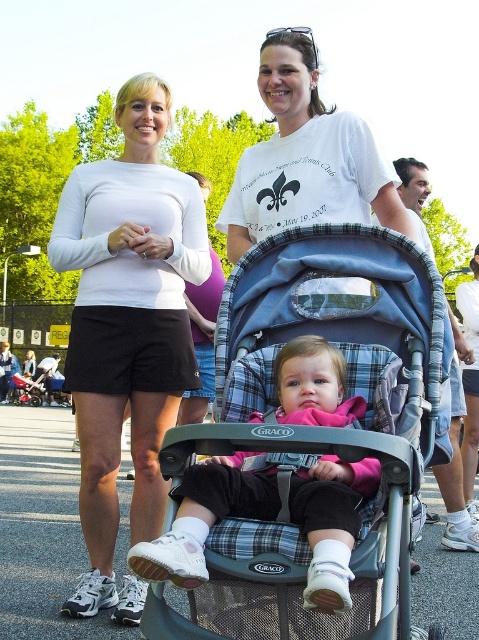
Question: Does blue plaid fabric stroller at center lie in front of white matte shorts at center?

Choices:
 (A) yes
 (B) no

Answer: (A)

Question: Does blue plaid fabric stroller at center lie behind white matte shorts at center?

Choices:
 (A) no
 (B) yes

Answer: (A)

Question: Considering the real-world distances, which object is farthest from the blue plaid fabric stroller at center?

Choices:
 (A) white matte shorts at center
 (B) white cotton t-shirt at center

Answer: (A)

Question: Does white matte shorts at center appear over white cotton t-shirt at center?

Choices:
 (A) yes
 (B) no

Answer: (B)

Question: Which point is farther from the camera taking this photo?

Choices:
 (A) (273, 65)
 (B) (376, 336)

Answer: (A)

Question: Which of the following is the farthest from the observer?

Choices:
 (A) white cotton t-shirt at center
 (B) white matte shorts at center

Answer: (A)